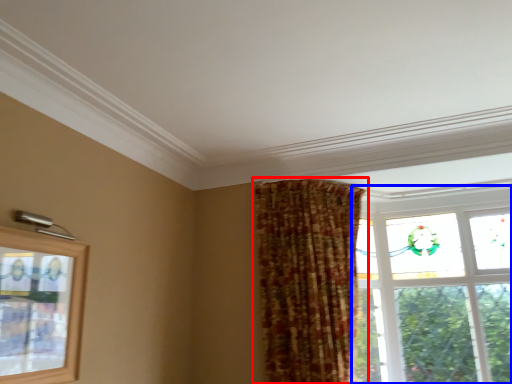
Question: Which object is further to the camera taking this photo, curtain (highlighted by a red box) or window (highlighted by a blue box)?

Choices:
 (A) curtain
 (B) window

Answer: (B)